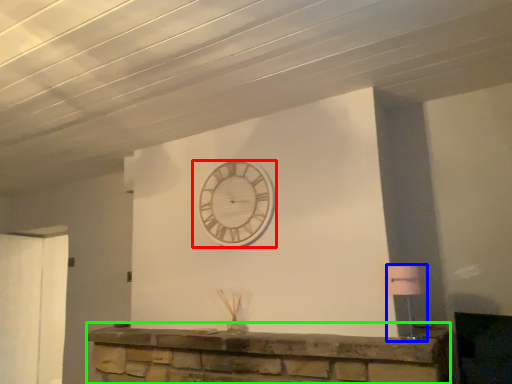
Question: Which object is positioned farthest from wall clock (highlighted by a red box)? Select from lamp (highlighted by a blue box) and furniture (highlighted by a green box).

Choices:
 (A) lamp
 (B) furniture

Answer: (A)